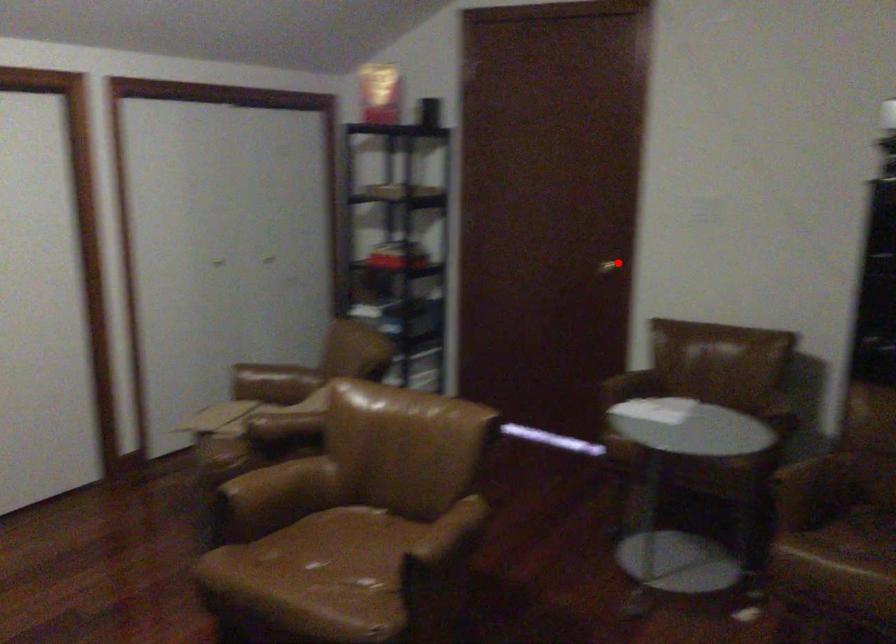
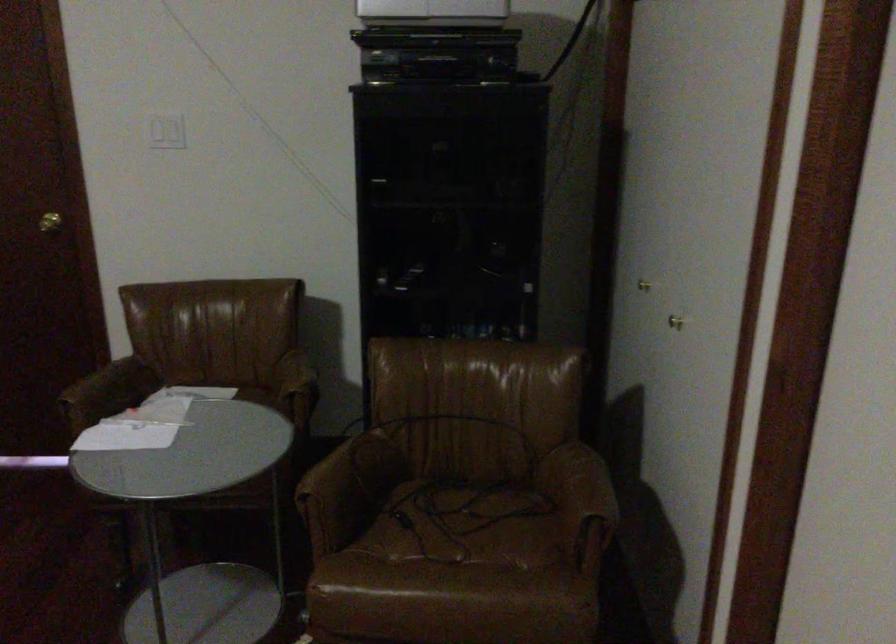
Question: I am providing you with two images of the same scene from different viewpoints. Given a red point in image1, look at the same physical point in image2. Is it:

Choices:
 (A) Closer to the viewpoint
 (B) Farther from the viewpoint

Answer: (A)